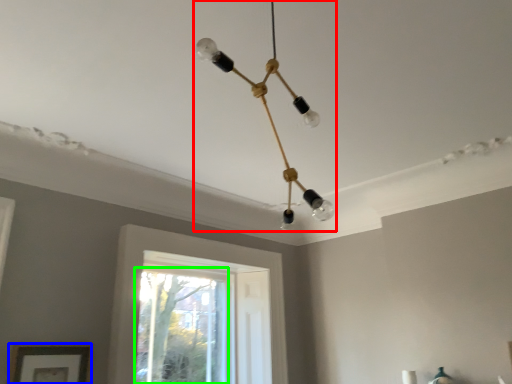
Question: Estimate the real-world distances between objects in this image. Which object is closer to lamp (highlighted by a red box), picture frame (highlighted by a blue box) or window (highlighted by a green box)?

Choices:
 (A) picture frame
 (B) window

Answer: (A)